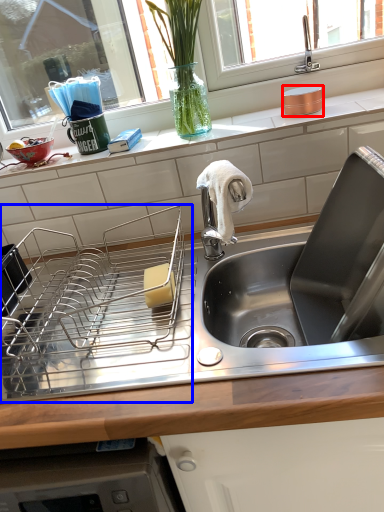
Question: Which point is further to the camera, appliance (highlighted by a red box) or appliance (highlighted by a blue box)?

Choices:
 (A) appliance
 (B) appliance

Answer: (A)